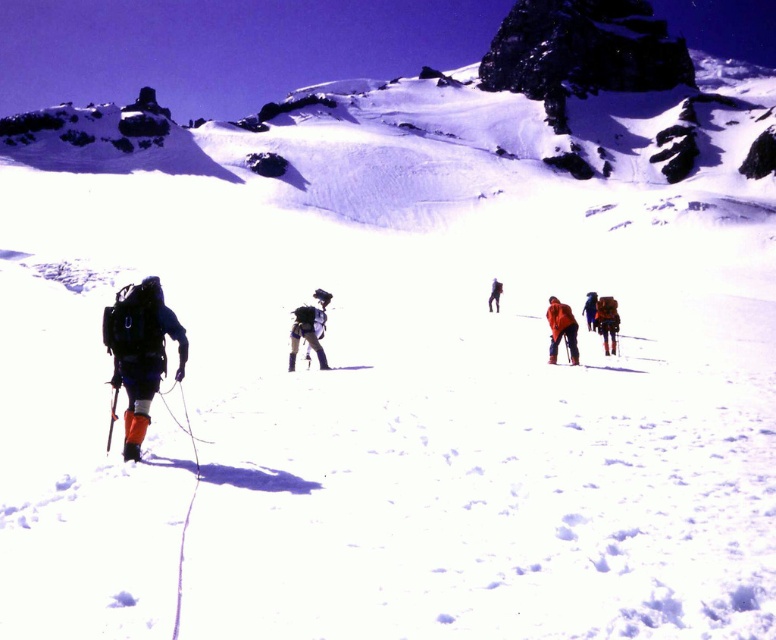
The image size is (776, 640). What do you see at coordinates (449, 144) in the screenshot?
I see `snowy rock at upper center` at bounding box center [449, 144].

Does snowy rock at upper center lie in front of matte black backpack at center?

No, snowy rock at upper center is behind matte black backpack at center.

Where is `snowy rock at upper center`? This screenshot has height=640, width=776. snowy rock at upper center is located at coordinates (449, 144).

Consider the image. Between orange fabric pants at left and orange fabric backpack at right, which one appears on the right side from the viewer's perspective?

orange fabric backpack at right

Where is `orange fabric pants at left`? This screenshot has width=776, height=640. orange fabric pants at left is located at coordinates (140, 353).

Does matte black backpack at center appear on the right side of orange fabric jacket at center?

In fact, matte black backpack at center is to the left of orange fabric jacket at center.

Who is taller, matte black backpack at center or orange fabric jacket at center?

matte black backpack at center is taller.

Between point (300, 317) and point (551, 340), which one is positioned behind?

The point (551, 340) is behind.

This screenshot has width=776, height=640. In order to click on matte black backpack at center in this screenshot , I will do `click(309, 328)`.